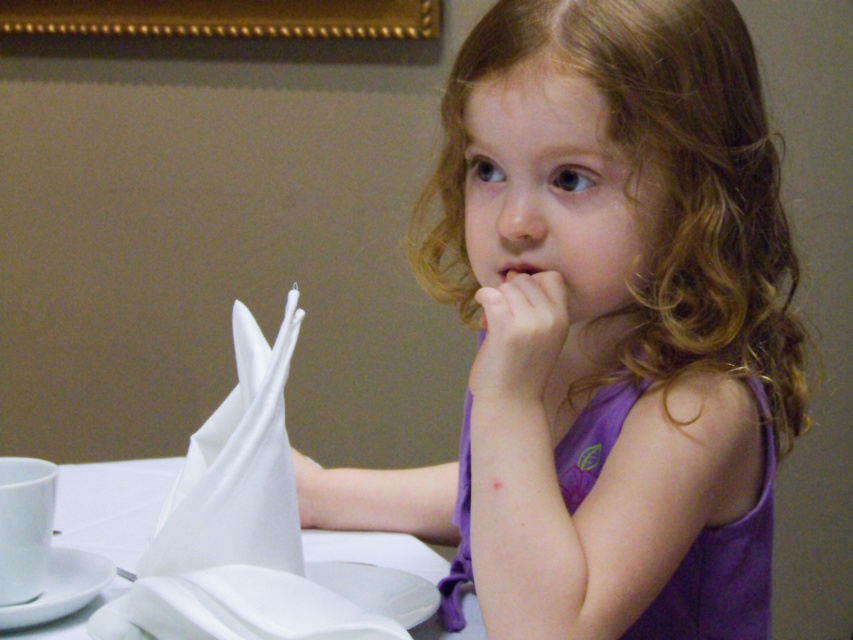
Can you confirm if purple fabric dress at center is positioned above matte skin nose at center?

No.

Is purple fabric dress at center positioned in front of matte skin nose at center?

Yes, it is.

Is point (602, 444) closer to camera compared to point (521, 230)?

No.

Find the location of `purple fabric dress at center`. purple fabric dress at center is located at coordinates (610, 328).

Measure the distance between white paper napkin at upper left and camera.

white paper napkin at upper left is 27.64 inches away from camera.

Does white paper napkin at upper left appear over smooth skin hand at center?

No.

Between point (61, 516) and point (558, 336), which one is positioned behind?

The point (61, 516) is more distant.

The height and width of the screenshot is (640, 853). In order to click on white paper napkin at upper left in this screenshot , I will do pos(111,506).

Which is above, white paper napkin at upper left or pink flesh at center?

pink flesh at center is higher up.

Who is more forward, [90,506] or [503,285]?

Point [503,285] is more forward.

Identify the location of white paper napkin at upper left. This screenshot has width=853, height=640. (111, 506).